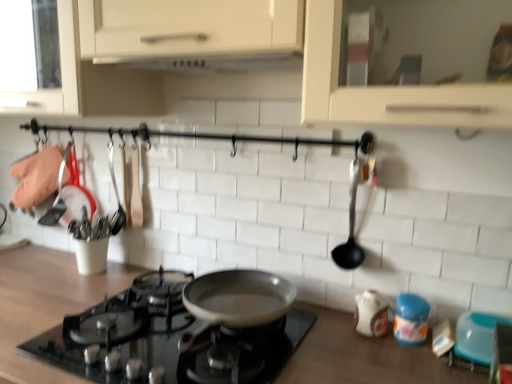
Question: From the image's perspective, does black glass gas stove at center appear lower than wooden countertop at center?

Choices:
 (A) no
 (B) yes

Answer: (A)

Question: Can you confirm if black glass gas stove at center is smaller than wooden countertop at center?

Choices:
 (A) yes
 (B) no

Answer: (A)

Question: Can you confirm if black glass gas stove at center is shorter than wooden countertop at center?

Choices:
 (A) yes
 (B) no

Answer: (A)

Question: From a real-world perspective, is black glass gas stove at center on top of wooden countertop at center?

Choices:
 (A) no
 (B) yes

Answer: (B)

Question: Is the position of black glass gas stove at center more distant than that of wooden countertop at center?

Choices:
 (A) yes
 (B) no

Answer: (A)

Question: Is black glass gas stove at center directly adjacent to wooden countertop at center?

Choices:
 (A) yes
 (B) no

Answer: (B)

Question: Is black glass gas stove at center taller than blue plastic bowl at lower right, which appears as the 1th appliance when viewed from the right?

Choices:
 (A) yes
 (B) no

Answer: (A)

Question: Can blue plastic bowl at lower right, the second appliance from the left, be found inside black glass gas stove at center?

Choices:
 (A) yes
 (B) no

Answer: (B)

Question: Would you say black glass gas stove at center is outside blue plastic bowl at lower right, the second appliance from the left?

Choices:
 (A) no
 (B) yes

Answer: (B)

Question: Does black glass gas stove at center have a larger size compared to blue plastic bowl at lower right, which appears as the 1th appliance when viewed from the right?

Choices:
 (A) yes
 (B) no

Answer: (A)

Question: From a real-world perspective, is black glass gas stove at center located higher than blue plastic bowl at lower right, the second appliance from the left?

Choices:
 (A) yes
 (B) no

Answer: (B)

Question: From the image's perspective, would you say black glass gas stove at center is shown under blue plastic bowl at lower right, which appears as the 1th appliance when viewed from the right?

Choices:
 (A) no
 (B) yes

Answer: (A)

Question: Considering the relative positions of wooden countertop at center and white matte exhaust hood at upper center in the image provided, is wooden countertop at center to the right of white matte exhaust hood at upper center from the viewer's perspective?

Choices:
 (A) no
 (B) yes

Answer: (A)